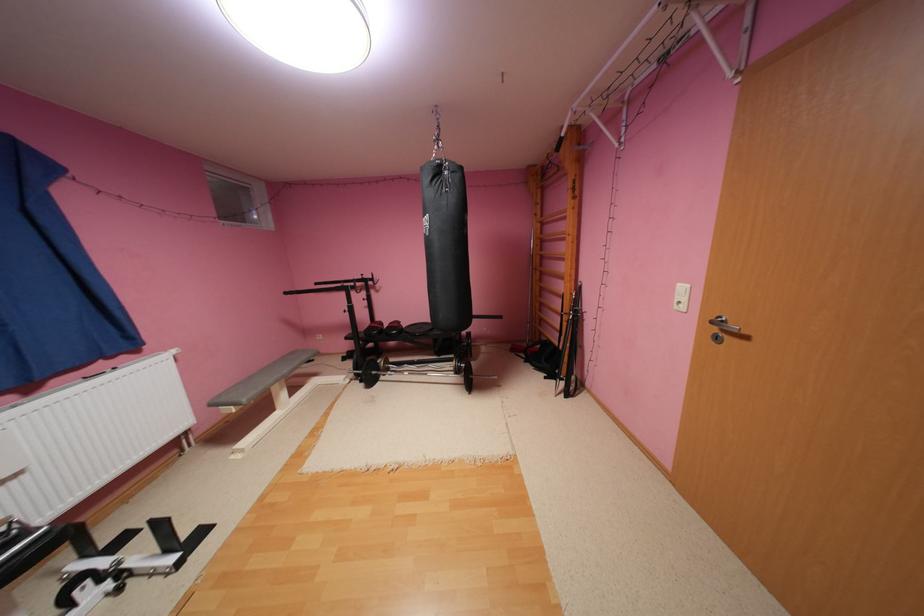
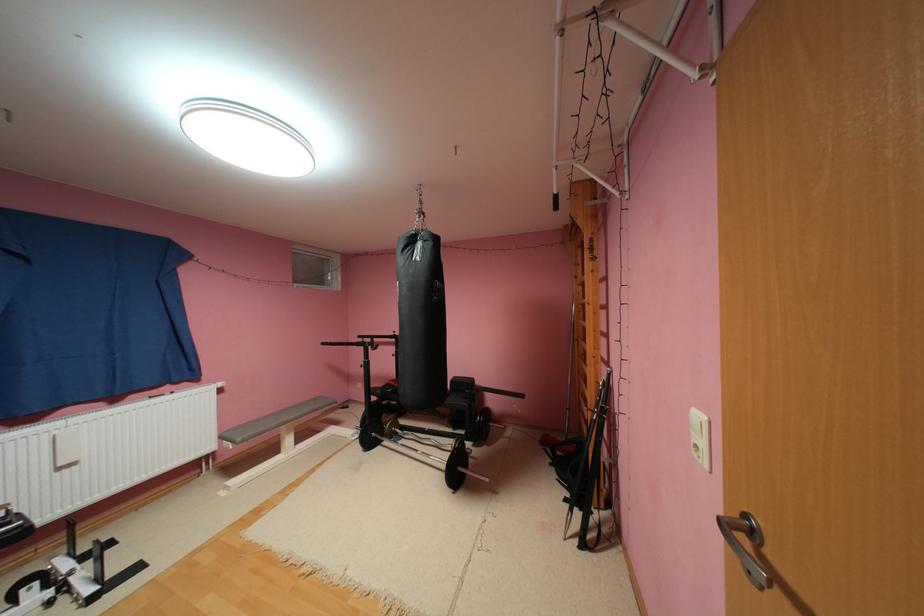
Locate, in the second image, the point that corresponds to (295,371) in the first image.

(300, 416)